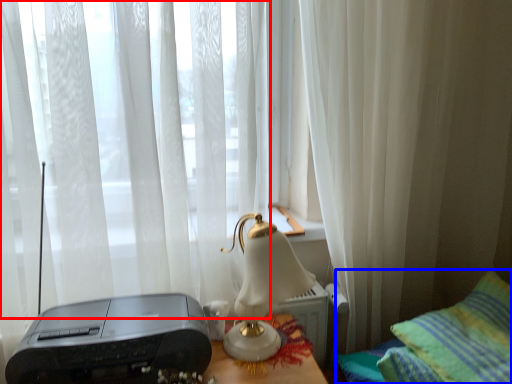
Question: Which point is further to the camera, curtain (highlighted by a red box) or furniture (highlighted by a blue box)?

Choices:
 (A) curtain
 (B) furniture

Answer: (A)